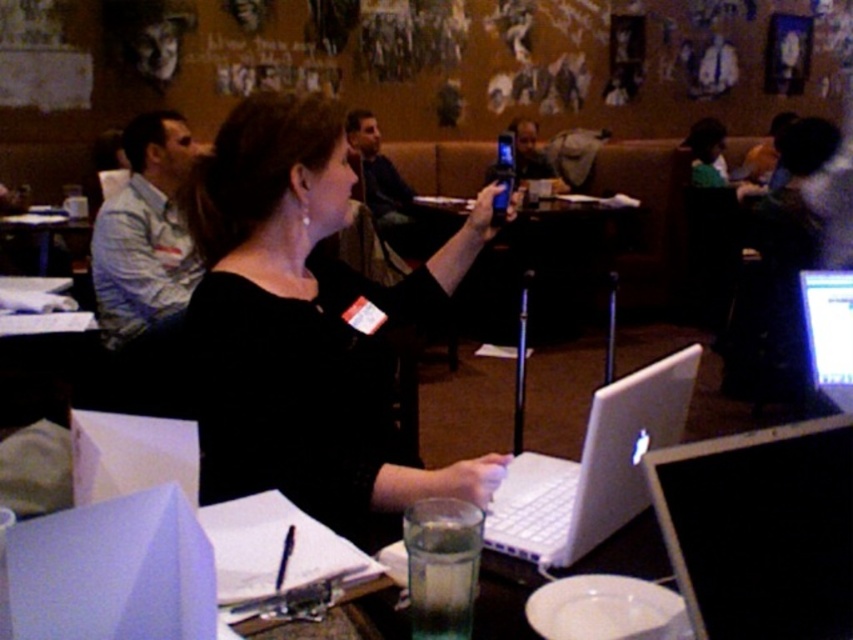
You are a photographer trying to capture a clear shot of the white glossy laptop at center without the white shirt at left blocking the view. Is this possible from your current position?

The white glossy laptop at center is behind the white shirt at left, so it is blocked by the shirt and cannot be seen clearly from the current position.

You are standing in the room and see two points marked on the wall. The first point is at coordinates point[793,541] and the second is at point[636,419]. Which point is closer to you?

Point[793,541] is closer to the viewer than point[636,419].